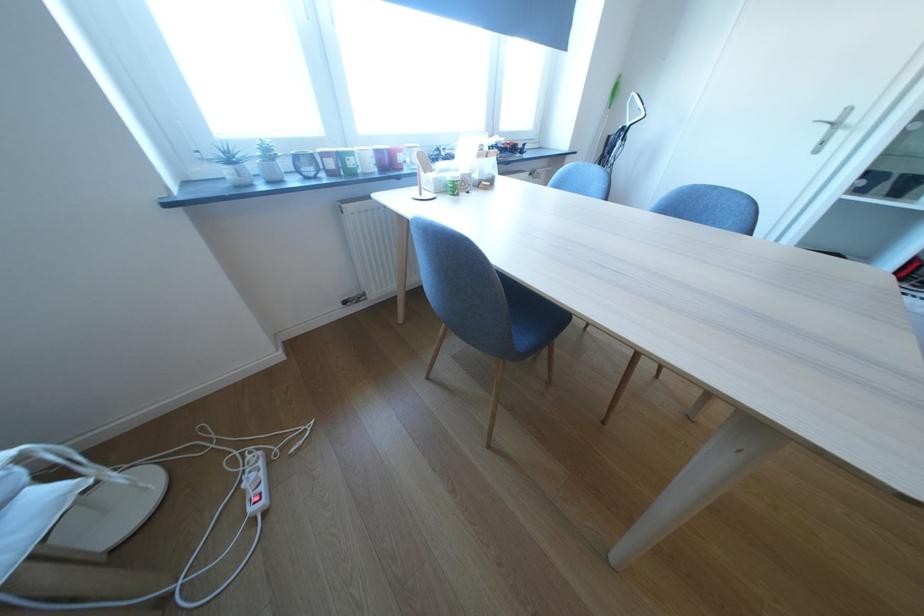
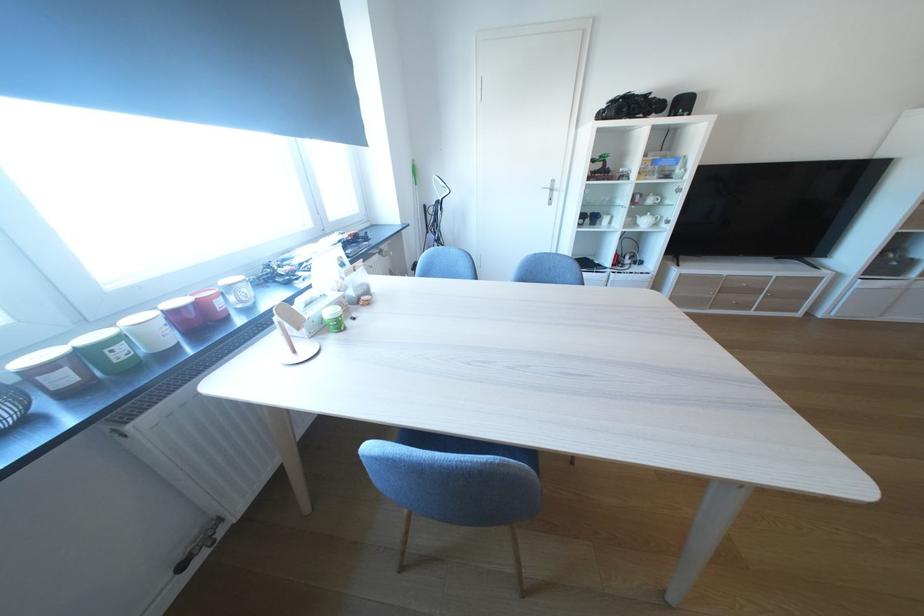
In the second image, find the point that corresponds to pixel 342 164 in the first image.

(75, 379)